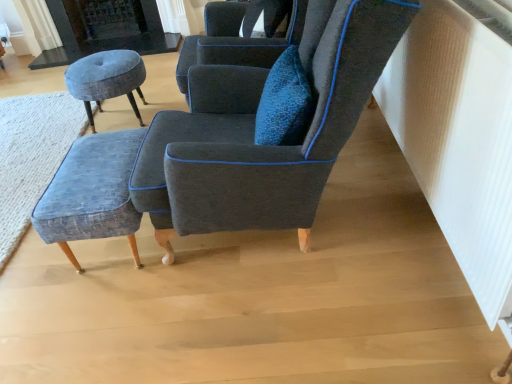
Locate an element on the screen. This screenshot has width=512, height=384. free area below textured blue fabric stool at lower left, the first stool in the front-to-back sequence (from a real-world perspective) is located at coordinates (106, 257).